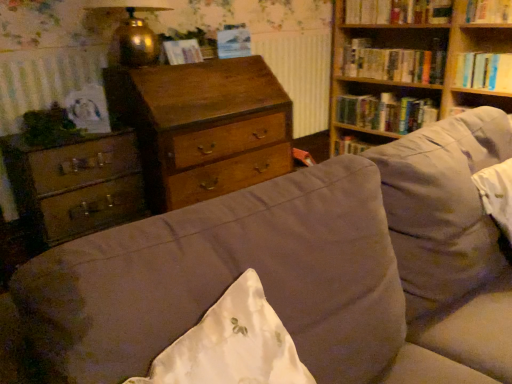
Find the location of `free location to the right of matte paper at center, the first paperback book viewed from the front`. free location to the right of matte paper at center, the first paperback book viewed from the front is located at coordinates (209, 61).